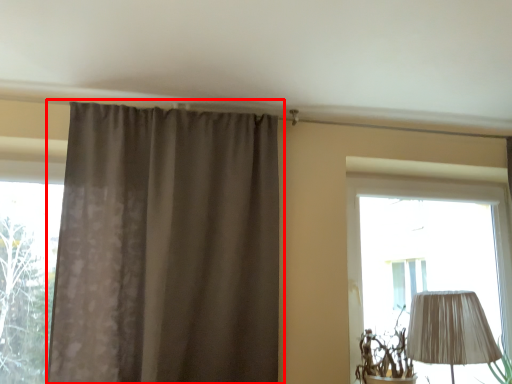
Question: Considering the relative positions of curtain (annotated by the red box) and window in the image provided, where is curtain (annotated by the red box) located with respect to the staircase?

Choices:
 (A) left
 (B) right

Answer: (B)